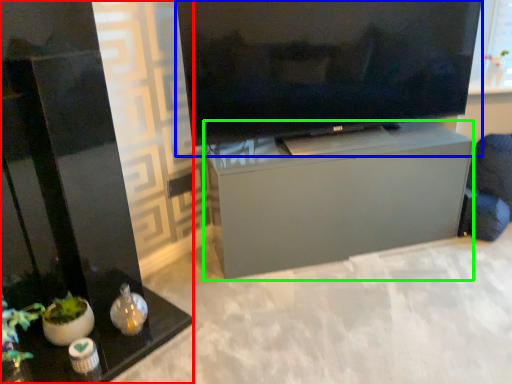
Question: Estimate the real-world distances between objects in this image. Which object is closer to furniture (highlighted by a red box), television (highlighted by a blue box) or furniture (highlighted by a green box)?

Choices:
 (A) television
 (B) furniture

Answer: (B)